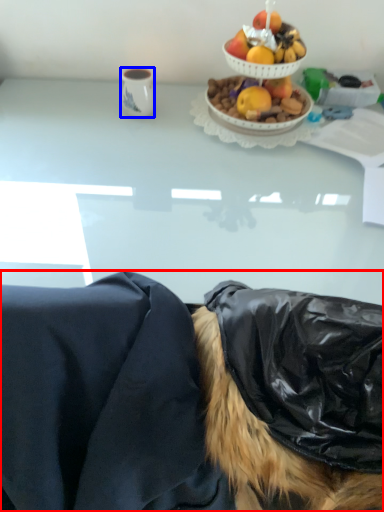
Question: Which of the following is the closest to the observer, person (highlighted by a red box) or coffee cup (highlighted by a blue box)?

Choices:
 (A) person
 (B) coffee cup

Answer: (A)